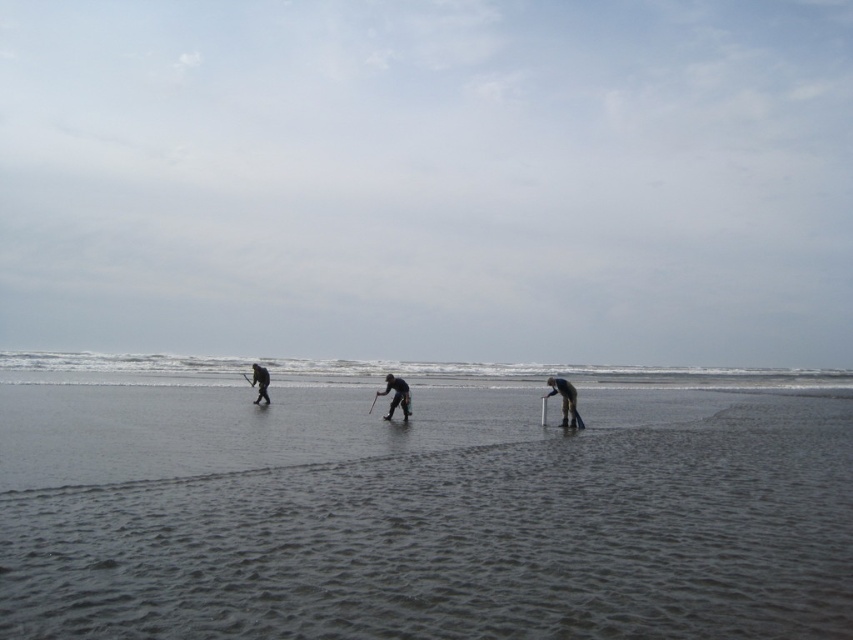
Between dark gray fabric pants at lower center and dark gray fabric pants at center, which one has less height?

Standing shorter between the two is dark gray fabric pants at center.

Between dark gray fabric pants at lower center and dark gray fabric pants at center, which one is positioned higher?

dark gray fabric pants at center is above.

Who is more distant from viewer, [564,408] or [387,380]?

Point [387,380]

This screenshot has width=853, height=640. Identify the location of dark gray fabric pants at lower center. (566, 401).

You are a GUI agent. You are given a task and a screenshot of the screen. Output one action in this format:
    pyautogui.click(x=<x>, y=<y>)
    Task: Click on the clear water at center
    
    Given the screenshot: What is the action you would take?
    pyautogui.click(x=387, y=371)

Which is below, clear water at center or dark gray fabric pants at left?

clear water at center is lower down.

The width and height of the screenshot is (853, 640). In order to click on clear water at center in this screenshot , I will do `click(387, 371)`.

At what (x,y) coordinates should I click in order to perform the action: click on clear water at center. Please return your answer as a coordinate pair (x, y). Image resolution: width=853 pixels, height=640 pixels. Looking at the image, I should click on pyautogui.click(x=387, y=371).

Does point (390, 403) come in front of point (251, 364)?

Yes.

Which is more to the right, dark gray fabric pants at center or dark gray fabric pants at left?

Positioned to the right is dark gray fabric pants at center.

Find the location of a particular element. The width and height of the screenshot is (853, 640). dark gray fabric pants at center is located at coordinates 396,396.